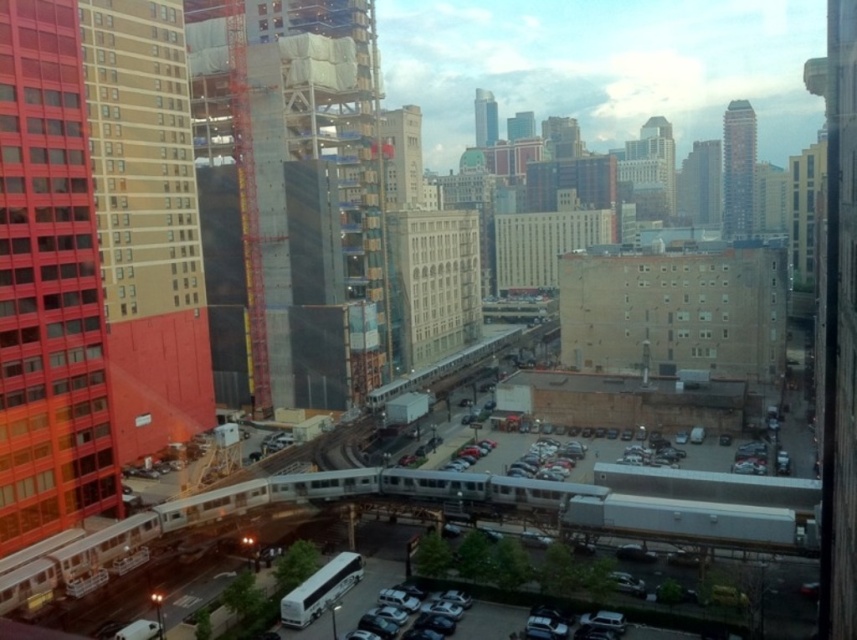
Question: Which point appears farthest from the camera in this image?

Choices:
 (A) (186, 97)
 (B) (427, 616)
 (C) (28, 90)

Answer: (A)

Question: In this image, where is smooth glass windows at left located relative to metallic silver car at lower center?

Choices:
 (A) left
 (B) right

Answer: (A)

Question: From the image, what is the correct spatial relationship of smooth glass windows at left in relation to tan smooth building at center-left?

Choices:
 (A) right
 (B) left

Answer: (A)

Question: Which point is farther from the camera taking this photo?

Choices:
 (A) (435, 625)
 (B) (3, 161)

Answer: (B)

Question: Can you confirm if smooth glass windows at left is wider than metallic silver car at lower center?

Choices:
 (A) no
 (B) yes

Answer: (A)

Question: Which of the following is the farthest from the observer?

Choices:
 (A) (106, 19)
 (B) (69, 154)

Answer: (A)